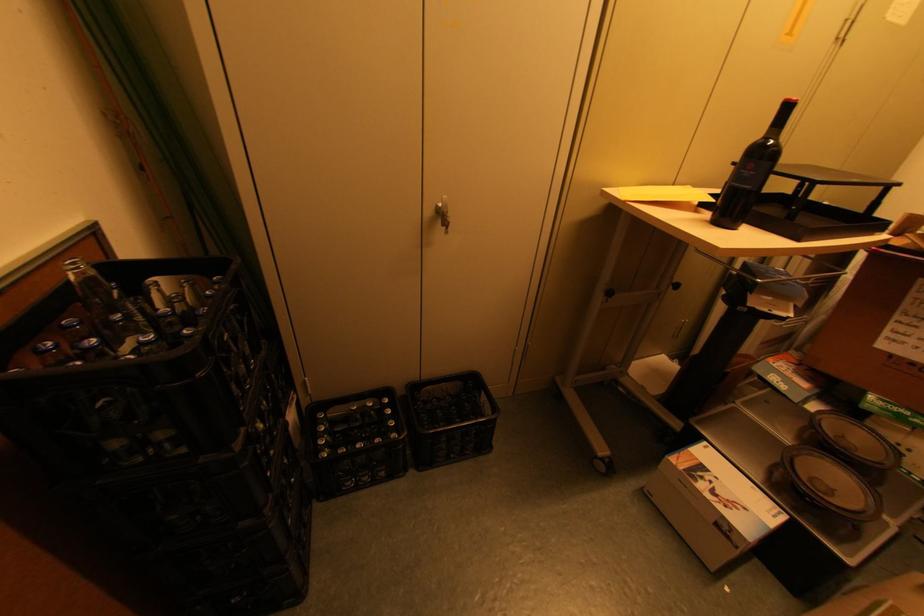
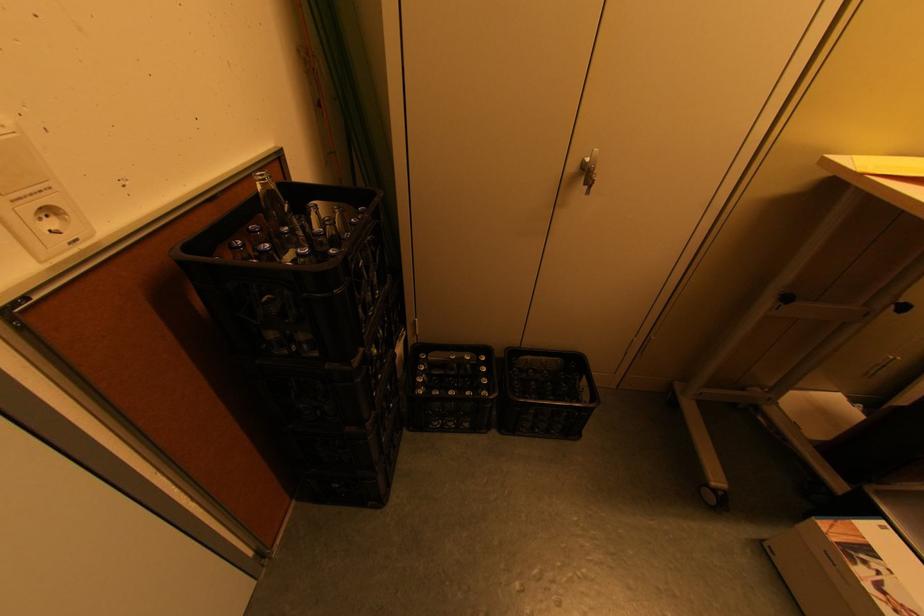
Find the pixel in the second image that matches pixel 40 349 in the first image.

(234, 244)